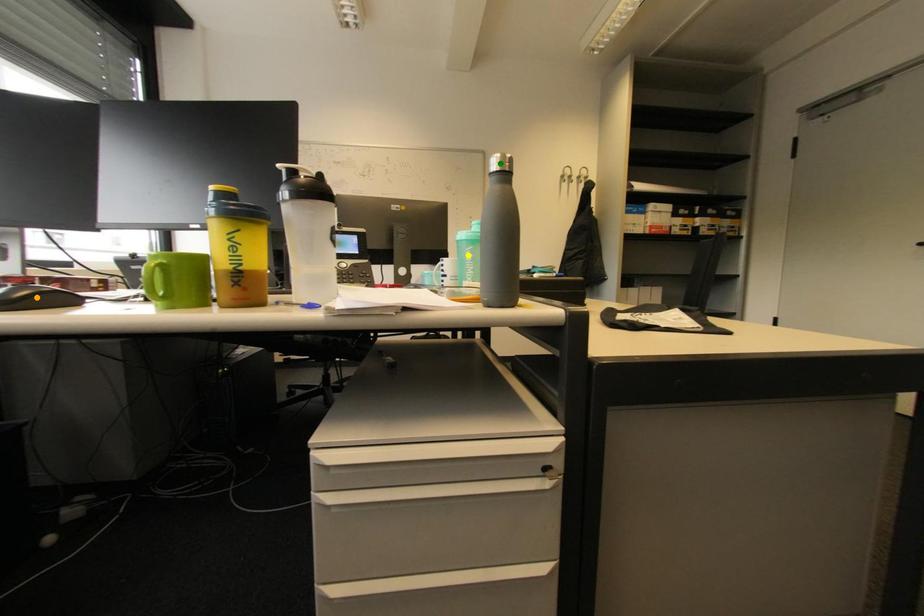
Order these from nearest to farthest:
A) green point
B) orange point
C) yellow point

orange point < green point < yellow point